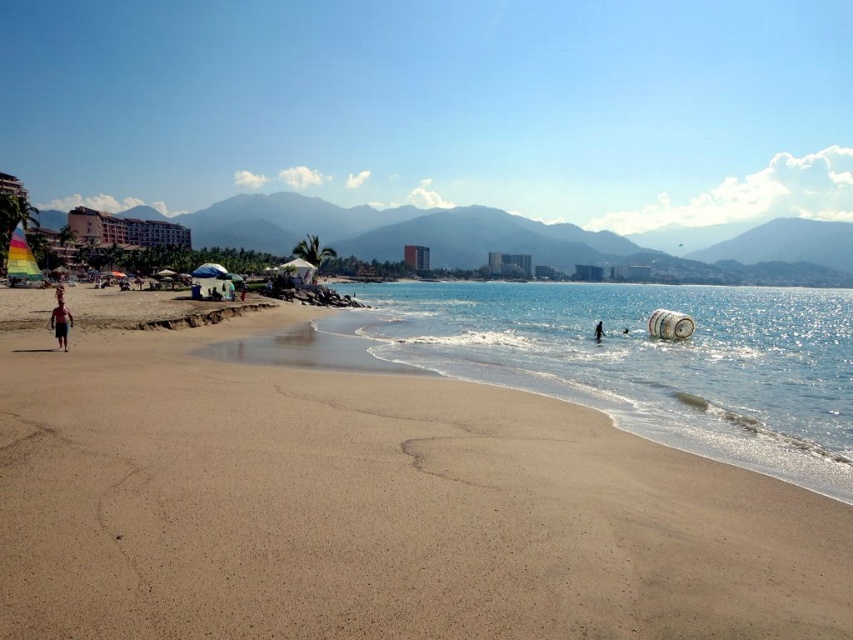
Is tan skin person at left behind smooth skin person at lower right?

No, tan skin person at left is closer to the viewer.

Can you confirm if tan skin person at left is positioned to the left of smooth skin person at lower right?

Correct, you'll find tan skin person at left to the left of smooth skin person at lower right.

Which is in front, point (62, 316) or point (601, 323)?

Point (62, 316) is more forward.

Where is `tan skin person at left`? The image size is (853, 640). tan skin person at left is located at coordinates (61, 323).

Is clear blue water at center thinner than smooth skin person at lower right?

In fact, clear blue water at center might be wider than smooth skin person at lower right.

Does clear blue water at center appear on the left side of smooth skin person at lower right?

Incorrect, clear blue water at center is not on the left side of smooth skin person at lower right.

Who is more forward, (656, 291) or (596, 324)?

Point (596, 324)

You are a GUI agent. You are given a task and a screenshot of the screen. Output one action in this format:
    pyautogui.click(x=<x>, y=<y>)
    Task: Click on the clear blue water at center
    This screenshot has width=853, height=640.
    Given the screenshot: What is the action you would take?
    pyautogui.click(x=646, y=360)

Between smooth sand at lower center and smooth skin person at lower right, which one is positioned higher?

Positioned higher is smooth skin person at lower right.

Is smooth sand at lower center bigger than smooth skin person at lower right?

Correct, smooth sand at lower center is larger in size than smooth skin person at lower right.

What do you see at coordinates (375, 509) in the screenshot? Image resolution: width=853 pixels, height=640 pixels. I see `smooth sand at lower center` at bounding box center [375, 509].

Identify the location of smooth sand at lower center. (375, 509).